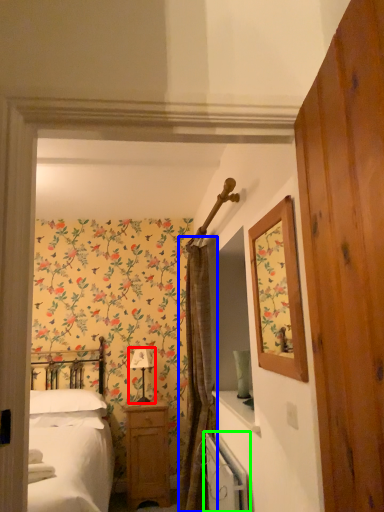
Question: Considering the real-world distances, which object is farthest from table lamp (highlighted by a red box)? curtain (highlighted by a blue box) or radiator (highlighted by a green box)?

Choices:
 (A) curtain
 (B) radiator

Answer: (B)